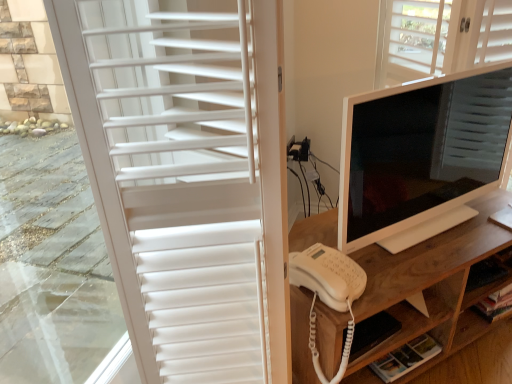
What do you see at coordinates (186, 175) in the screenshot? I see `white matte shutter at left` at bounding box center [186, 175].

The height and width of the screenshot is (384, 512). What do you see at coordinates (328, 275) in the screenshot? I see `white plastic telephone at center` at bounding box center [328, 275].

This screenshot has height=384, width=512. In order to click on wooden desk at center in this screenshot , I will do `click(426, 282)`.

Is wooden desk at center inside or outside of white glossy monitor at center?

wooden desk at center is located beyond the bounds of white glossy monitor at center.

Does point (482, 232) lie in front of point (417, 114)?

No, (482, 232) is behind (417, 114).

From the picture: Is wooden desk at center positioned with its back to white glossy monitor at center?

No.

Are wooden desk at center and white glossy monitor at center beside each other?

No, wooden desk at center is not beside white glossy monitor at center.

Considering the relative sizes of white glossy monitor at center and wooden desk at center in the image provided, is white glossy monitor at center taller than wooden desk at center?

Yes.

Based on the photo, considering the sizes of objects white glossy monitor at center and wooden desk at center in the image provided, who is smaller, white glossy monitor at center or wooden desk at center?

white glossy monitor at center.

Is point (359, 160) farther from viewer compared to point (410, 267)?

No, it is in front of (410, 267).

From the image's perspective, is white glossy monitor at center located above or below wooden desk at center?

From the image's perspective, white glossy monitor at center appears above wooden desk at center.

Between point (295, 242) and point (418, 321), which one is positioned in front?

The point (418, 321) is closer.

Can we say wooden desk at center lies outside white wood shelf at lower right?

Indeed, wooden desk at center is completely outside white wood shelf at lower right.

From the image's perspective, is wooden desk at center beneath white wood shelf at lower right?

Incorrect, from the image's perspective, wooden desk at center is higher than white wood shelf at lower right.

At what (x,y) coordinates should I click in order to perform the action: click on shelf on the left of wooden desk at center. Please return your answer as a coordinate pair (x, y). Looking at the image, I should click on (366, 358).

In the scene shown: From the image's perspective, is white wood shelf at lower right located above white glossy monitor at center?

No, from the image's perspective, white wood shelf at lower right is not above white glossy monitor at center.

Consider the image. Is white wood shelf at lower right positioned with its back to white glossy monitor at center?

No, white wood shelf at lower right is not facing the opposite direction of white glossy monitor at center.

Based on the photo, would you say white wood shelf at lower right is a long distance from white glossy monitor at center?

They are positioned close to each other.

Does white wood shelf at lower right come in front of white glossy monitor at center?

No, white wood shelf at lower right is further to the viewer.

Is point (339, 358) positioned in front of point (349, 257)?

Yes, it is.

Based on the photo, is white plastic telephone at center inside wooden desk at center?

That's incorrect, white plastic telephone at center is not inside wooden desk at center.

From a real-world perspective, between wooden desk at center and white plastic telephone at center, who is vertically higher?

white plastic telephone at center is physically above.

Which is behind, white wood shelf at lower right or white matte shutter at left?

Positioned behind is white wood shelf at lower right.

Is white wood shelf at lower right smaller than white matte shutter at left?

Indeed, white wood shelf at lower right has a smaller size compared to white matte shutter at left.

The width and height of the screenshot is (512, 384). What are the coordinates of `shutter located on the left of white wood shelf at lower right` in the screenshot? It's located at (186, 175).

From the image's perspective, which one is positioned lower, white wood shelf at lower right or white matte shutter at left?

white wood shelf at lower right, from the image's perspective.

Does point (261, 339) lie in front of point (444, 79)?

Yes, point (261, 339) is in front of point (444, 79).

Is white matte shutter at left oriented away from white glossy monitor at center?

No.

Is white glossy monitor at center located within white matte shutter at left?

No.

In the scene shown: Is white matte shutter at left beside white glossy monitor at center?

white matte shutter at left and white glossy monitor at center are not in contact.

Where is `computer monitor in front of the wooden desk at center`? The width and height of the screenshot is (512, 384). computer monitor in front of the wooden desk at center is located at coordinates (421, 156).

Locate an element on the screen. computer monitor on the right side of wooden desk at center is located at coordinates (421, 156).

When comparing their distances from wooden desk at center, does white glossy monitor at center or white plastic telephone at center seem further?

white glossy monitor at center is positioned further to the anchor wooden desk at center.

Looking at this image, considering their positions, is white wood shelf at lower right positioned further to wooden desk at center than white plastic telephone at center?

white plastic telephone at center is positioned further to the anchor wooden desk at center.

Which object lies nearer to the anchor point white glossy monitor at center, white wood shelf at lower right or white plastic telephone at center?

Among the two, white plastic telephone at center is located nearer to white glossy monitor at center.

Based on the photo, looking at the image, which one is located closer to white matte shutter at left, white wood shelf at lower right or wooden desk at center?

wooden desk at center is positioned closer to the anchor white matte shutter at left.

Estimate the real-world distances between objects in this image. Which object is further from white matte shutter at left, white plastic telephone at center or white glossy monitor at center?

The object further to white matte shutter at left is white glossy monitor at center.

When comparing their distances from white glossy monitor at center, does white matte shutter at left or white plastic telephone at center seem closer?

white plastic telephone at center is closer to white glossy monitor at center.

From the image, which object appears to be nearer to white glossy monitor at center, white matte shutter at left or white wood shelf at lower right?

white wood shelf at lower right is closer to white glossy monitor at center.

When comparing their distances from white wood shelf at lower right, does white plastic telephone at center or white glossy monitor at center seem closer?

white plastic telephone at center lies closer to white wood shelf at lower right than the other object.

This screenshot has height=384, width=512. Identify the location of open between white glossy monitor at center and white wood shelf at lower right in the vertical direction. (328, 275).

This screenshot has width=512, height=384. Identify the location of shelf situated between white plastic telephone at center and wooden desk at center from left to right. (366, 358).

The height and width of the screenshot is (384, 512). Identify the location of open situated between white matte shutter at left and white glossy monitor at center from left to right. (328, 275).

Locate an element on the screen. This screenshot has height=384, width=512. open that lies between white glossy monitor at center and wooden desk at center from top to bottom is located at coordinates (328, 275).